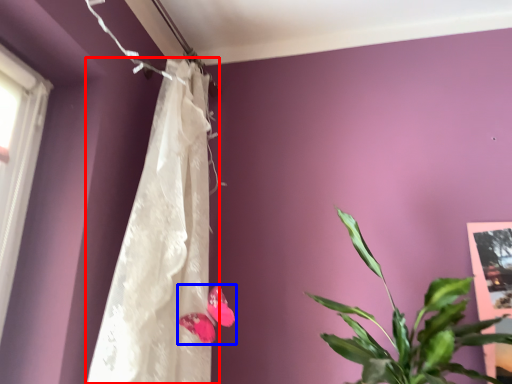
Question: Which point is closer to the camera, curtain (highlighted by a red box) or flower (highlighted by a blue box)?

Choices:
 (A) curtain
 (B) flower

Answer: (A)